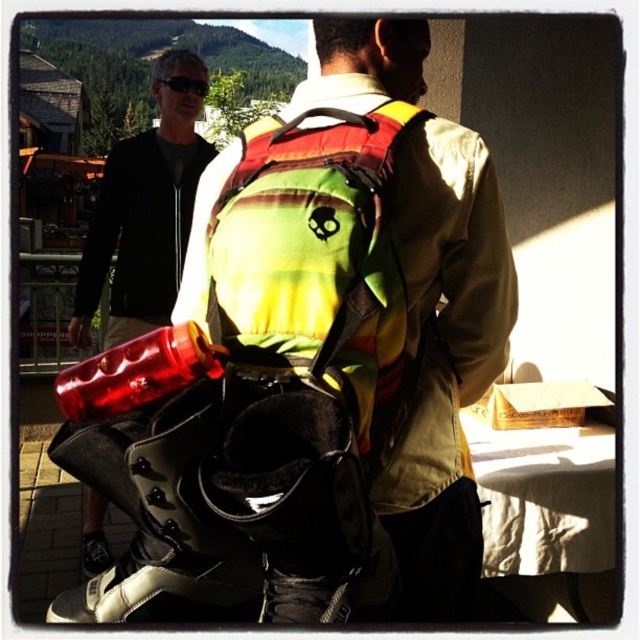
Between point (364, 378) and point (152, 81), which one is positioned behind?

The point (152, 81) is behind.

Who is more forward, (310, 358) or (177, 88)?

Point (310, 358) is in front.

I want to click on rasta-colored fabric safety vest at back, so click(x=314, y=253).

Between point (122, 609) and point (173, 90), which one is positioned behind?

The point (173, 90) is behind.

Looking at this image, between rasta-patterned backpack at center and black plastic goggles at upper center, which one appears on the left side from the viewer's perspective?

black plastic goggles at upper center is more to the left.

Is point (228, 355) less distant than point (173, 88)?

Yes, point (228, 355) is closer to viewer.

The height and width of the screenshot is (640, 640). In order to click on rasta-patterned backpack at center in this screenshot , I will do `click(308, 365)`.

Who is shorter, brushed metal water bottle at left or black plastic goggles at upper center?

black plastic goggles at upper center is shorter.

Is the position of brushed metal water bottle at left more distant than that of black plastic goggles at upper center?

That is False.

Measure the distance between brushed metal water bottle at left and camera.

They are 3.18 meters apart.

At what (x,y) coordinates should I click in order to perform the action: click on brushed metal water bottle at left. Please return your answer as a coordinate pair (x, y). The width and height of the screenshot is (640, 640). Looking at the image, I should click on (145, 212).